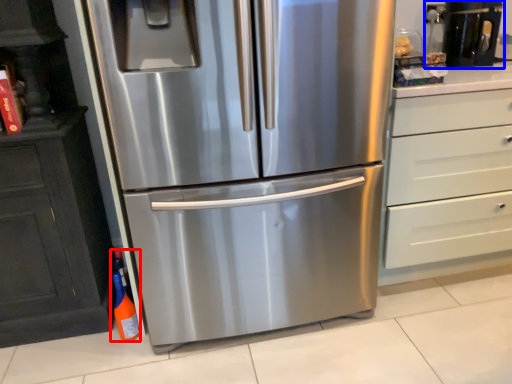
Question: Among these objects, which one is nearest to the camera, bottle (highlighted by a red box) or coffee machine (highlighted by a blue box)?

Choices:
 (A) bottle
 (B) coffee machine

Answer: (A)